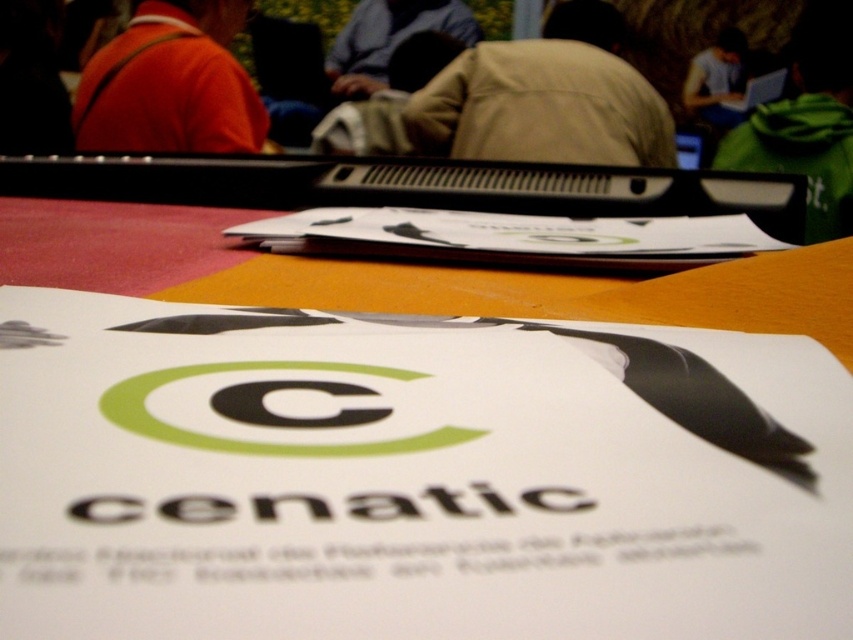
You are an event organizer who needs to place a new name tag on the table. The name tag must be placed in an area that is not obscured by the green fleece jacket at upper right. Where should you place the name tag?

The green fleece jacket at upper right is located at point (807, 122), so placing the name tag in an area away from that coordinate would ensure it remains visible and unobstructed.

You are organizing a conference and need to arrange jackets on a table. The table has a sign in the foreground. You have two jackets to place on the table. Where should you position the beige fabric jacket at center and the matte orange jacket at upper left so they match the image?

Place the beige fabric jacket at center to the right of the matte orange jacket at upper left.

Based on the photo, you are organizing a conference and need to arrange jackets on a table. The table has limited space. You have two jackets to place on it. The beige fabric jacket at center and the matte orange jacket at upper left. Which jacket should you place lower on the table to save space?

The beige fabric jacket at center is above the matte orange jacket at upper left, so to place the matte orange jacket at upper left lower on the table, you should position it below the beige fabric jacket at center to save space.